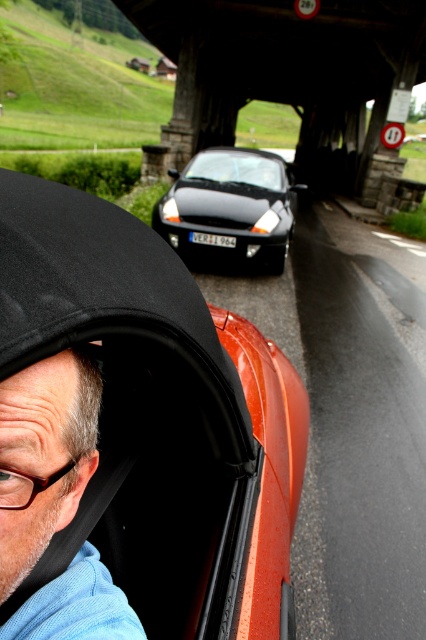
Question: Can you confirm if shiny orange car at center is positioned below wooden bridge at center?

Choices:
 (A) yes
 (B) no

Answer: (A)

Question: Among these points, which one is farthest from the camera?

Choices:
 (A) (22, 461)
 (B) (80, 280)
 (C) (396, 157)

Answer: (C)

Question: From the image, what is the correct spatial relationship of shiny orange car at center in relation to wooden bridge at center?

Choices:
 (A) right
 (B) left

Answer: (B)

Question: Which point is farther to the camera?

Choices:
 (A) pyautogui.click(x=290, y=200)
 (B) pyautogui.click(x=88, y=464)
 (C) pyautogui.click(x=2, y=333)
 (D) pyautogui.click(x=261, y=8)

Answer: (D)

Question: Which point appears farthest from the camera in this image?

Choices:
 (A) (221, 419)
 (B) (20, 380)
 (C) (285, 193)

Answer: (C)

Question: From the image, what is the correct spatial relationship of shiny orange car at center in relation to light blue fabric at lower left?

Choices:
 (A) above
 (B) below

Answer: (B)